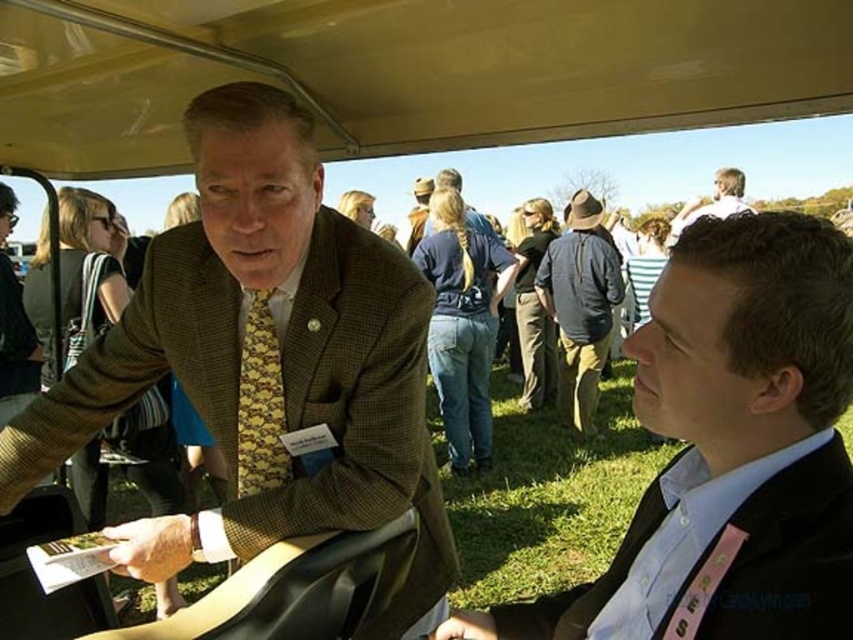
You are a photographer positioned outside the vehicle and want to take a photo of the matte brown suit at center and the yellow patterned tie at center. If your camera has a minimum focus distance of 14 centimeters, will both subjects be in focus?

The matte brown suit at center is 14.48 centimeters away from the yellow patterned tie at center. Since the distance between them is slightly more than the camera minimum focus distance of 14 centimeters, both subjects will be in focus as they are within the camera range.

You are a photographer standing outside the vehicle and want to take a photo of the matte brown suit at center and the yellow patterned tie at center. Which object should you focus on first if you want to capture both clearly in the same frame?

The matte brown suit at center is much taller than the yellow patterned tie at center, so you should focus on the matte brown suit at center first to ensure both are in focus.

You are a photographer standing outside the vehicle and want to capture a closeup of the yellow patterned tie at center. Based on its position, which direction should you move relative to the vehicle to get the best shot?

The yellow patterned tie at center is located at point (260, 403), so you should move towards the center of the vehicle to get the best shot.